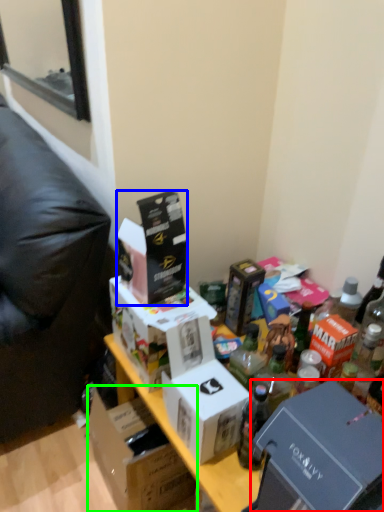
Question: Considering the real-world distances, which object is closest to box (highlighted by a red box)? box (highlighted by a blue box) or box (highlighted by a green box).

Choices:
 (A) box
 (B) box

Answer: (A)